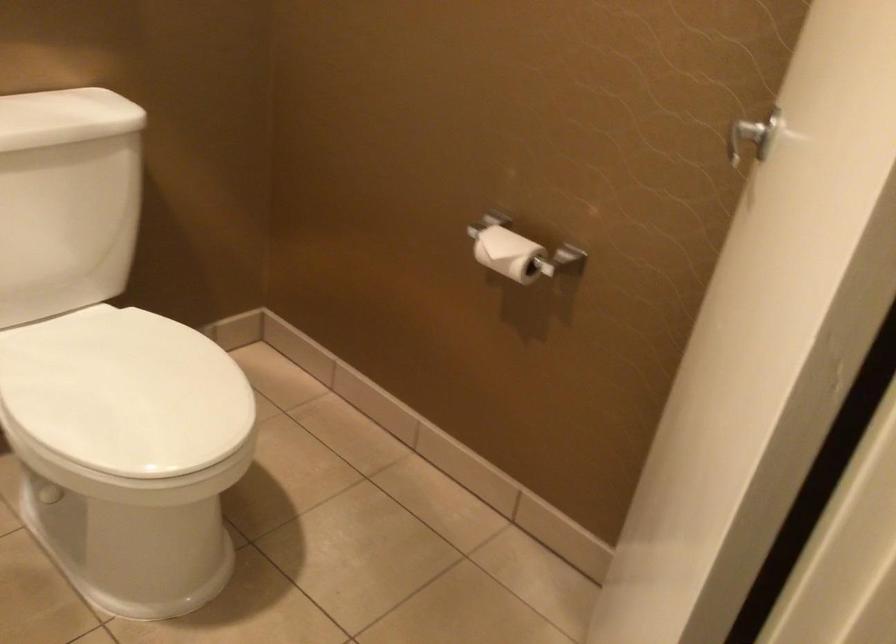
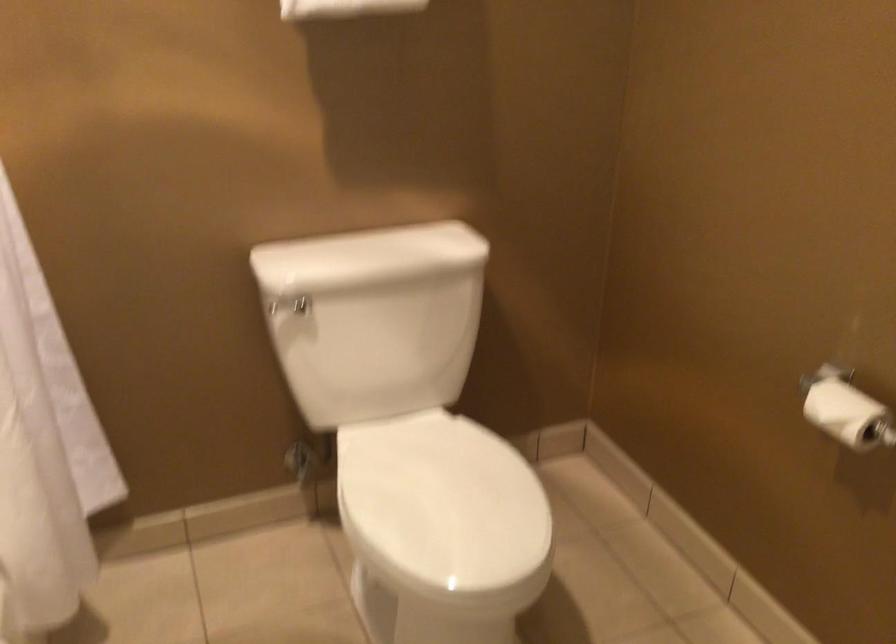
Where in the second image is the point corresponding to pixel 511 252 from the first image?

(847, 413)